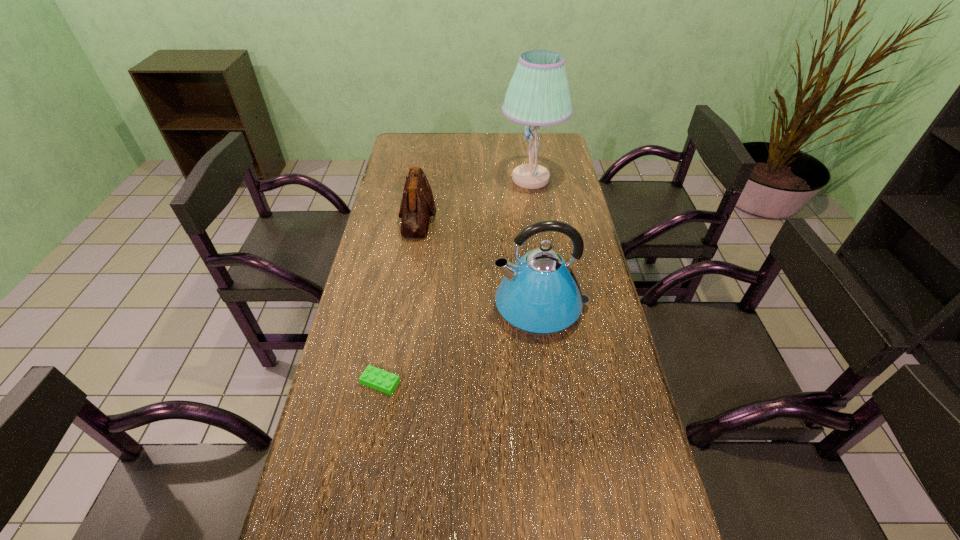
This screenshot has width=960, height=540. Find the location of `the tallest object`. the tallest object is located at coordinates (538, 94).

Identify the location of the second nearest object. This screenshot has width=960, height=540. (539, 295).

In order to click on the third shortest object in this screenshot , I will do `click(539, 295)`.

This screenshot has height=540, width=960. Identify the location of shoulder bag. (417, 205).

Find the location of a particular element. The image size is (960, 540). the nearest object is located at coordinates (373, 377).

Where is `Lego`? The height and width of the screenshot is (540, 960). Lego is located at coordinates (373, 377).

Image resolution: width=960 pixels, height=540 pixels. Find the location of `free spot located on the front of the tallest object`. free spot located on the front of the tallest object is located at coordinates (541, 252).

The height and width of the screenshot is (540, 960). Identify the location of free space located at the spout of the third farthest object. [438, 307].

You are a GUI agent. You are given a task and a screenshot of the screen. Output one action in this format:
    pyautogui.click(x=<x>, y=<y>)
    Task: Click on the blank area located 0.330m at the spout of the third farthest object
    The image size is (960, 540).
    Given the screenshot: What is the action you would take?
    pyautogui.click(x=378, y=307)

Find the location of a particular element. free spot located 0.120m at the spout of the third farthest object is located at coordinates (451, 307).